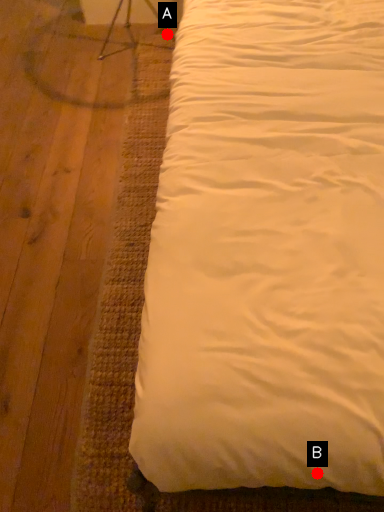
Question: Two points are circled on the image, labeled by A and B beside each circle. Among these points, which one is farthest from the camera?

Choices:
 (A) A is further
 (B) B is further

Answer: (A)